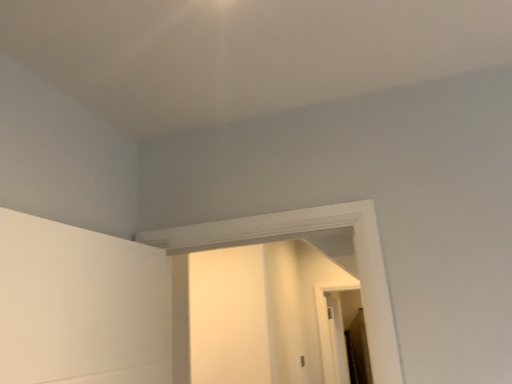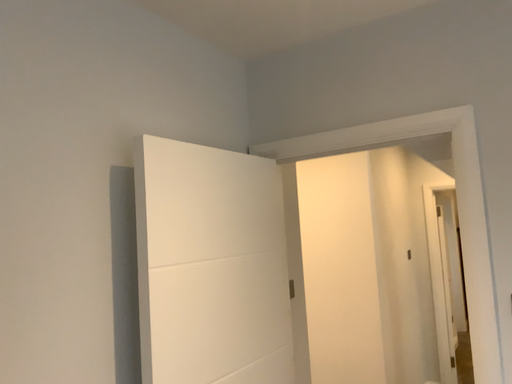
Question: How did the camera likely rotate when shooting the video?

Choices:
 (A) rotated right
 (B) rotated left

Answer: (B)